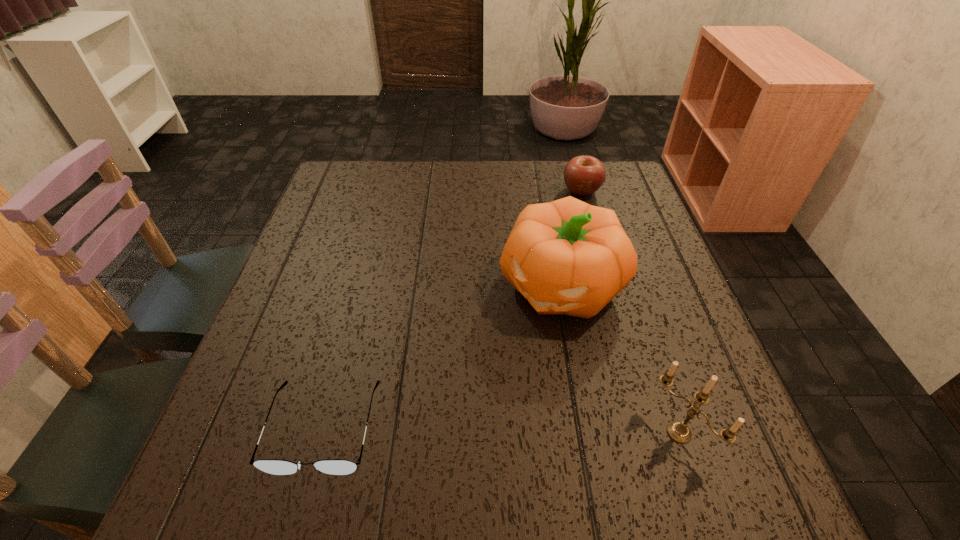
Find the location of a particular element. Image resolution: width=960 pixels, height=540 pixels. vacant space on the desktop that is between the shortest object and the third shortest object and is positioned on the side of the farthest object with the unique marking is located at coordinates (456, 429).

Locate an element on the screen. vacant space on the desktop that is between the shortest object and the candle and is positioned on the carved face of the second farthest object is located at coordinates (459, 429).